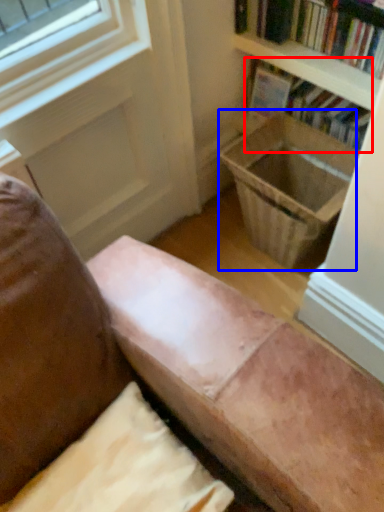
Question: Which object is closer to the camera taking this photo, book (highlighted by a red box) or laundry basket (highlighted by a blue box)?

Choices:
 (A) book
 (B) laundry basket

Answer: (B)